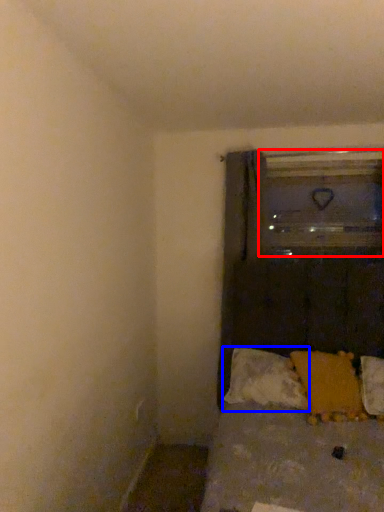
Question: Which object appears farthest to the camera in this image, glass door (highlighted by a red box) or pillow (highlighted by a blue box)?

Choices:
 (A) glass door
 (B) pillow

Answer: (A)